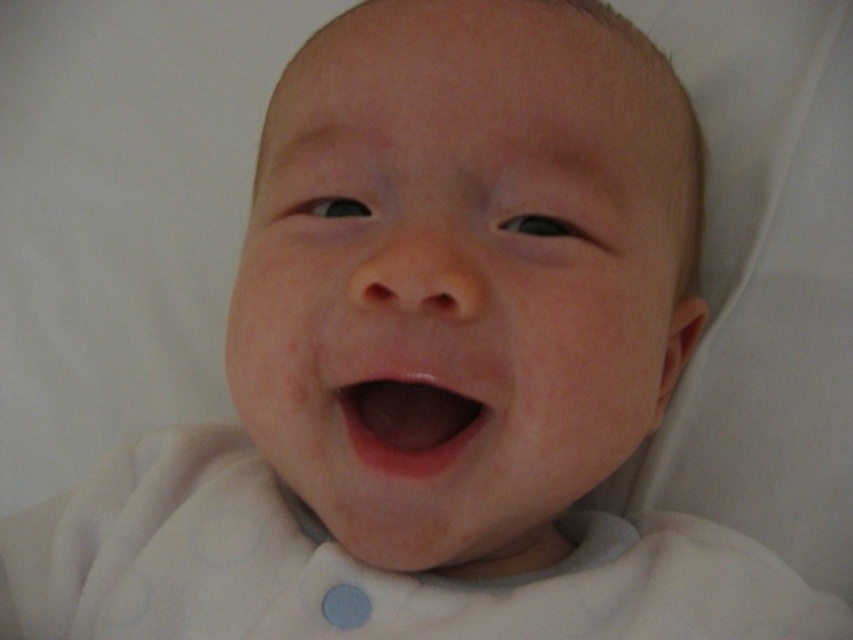
You are a pediatrician examining a baby. You notice the smooth skin baby at center and the pink smooth flesh at center. Which part is higher up on the baby?

The smooth skin baby at center is located above the pink smooth flesh at center, so the smooth skin baby at center is higher up.

You are a photographer adjusting the focus on a camera. You need to focus on two points in the image, point (404, 240) and point (381, 380). Which point should you focus on first if you want to ensure the baby is in focus?

You should focus on point (404, 240) first because it is closer to the camera than point (381, 380), which is further away.

You are a pediatrician examining a baby. You notice two areas on the baby at center. The smooth skin baby at center and the pink smooth flesh at center. Which one is larger?

The smooth skin baby at center is bigger than the pink smooth flesh at center.